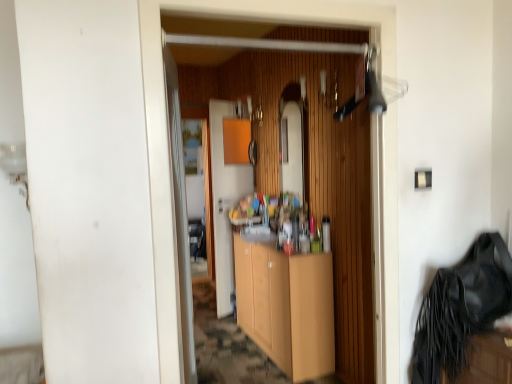
Image resolution: width=512 pixels, height=384 pixels. Describe the element at coordinates (287, 307) in the screenshot. I see `light wood cabinet at center` at that location.

Locate an element on the screen. Image resolution: width=512 pixels, height=384 pixels. light wood cabinet at center is located at coordinates (287, 307).

You are a GUI agent. You are given a task and a screenshot of the screen. Output one action in this format:
    pyautogui.click(x=<x>, y=<y>)
    Task: Click on the wooden cabinet at center
    
    Given the screenshot: What is the action you would take?
    pyautogui.click(x=225, y=201)

This screenshot has height=384, width=512. What do you see at coordinates (225, 201) in the screenshot?
I see `wooden cabinet at center` at bounding box center [225, 201].

Find the location of a particular element. This screenshot has width=512, height=384. light wood cabinet at center is located at coordinates (287, 307).

Is wooden cabinet at center to the right of light wood cabinet at center from the viewer's perspective?

In fact, wooden cabinet at center is to the left of light wood cabinet at center.

Which object is more forward, wooden cabinet at center or light wood cabinet at center?

light wood cabinet at center is in front.

Between point (213, 117) and point (314, 269), which one is positioned behind?

Positioned behind is point (213, 117).

From the image's perspective, is wooden cabinet at center above or below light wood cabinet at center?

wooden cabinet at center is above light wood cabinet at center.

From a real-world perspective, is wooden cabinet at center on light wood cabinet at center?

Indeed, from a real-world perspective, wooden cabinet at center stands above light wood cabinet at center.

Can you confirm if wooden cabinet at center is thinner than light wood cabinet at center?

Yes.

Considering the sizes of wooden cabinet at center and light wood cabinet at center in the image, is wooden cabinet at center taller or shorter than light wood cabinet at center?

Clearly, wooden cabinet at center is taller compared to light wood cabinet at center.

Between wooden cabinet at center and light wood cabinet at center, which one has larger size?

With larger size is light wood cabinet at center.

Do you think wooden cabinet at center is within light wood cabinet at center, or outside of it?

wooden cabinet at center exists outside the volume of light wood cabinet at center.

Is wooden cabinet at center in contact with light wood cabinet at center?

wooden cabinet at center and light wood cabinet at center are clearly separated.

Is wooden cabinet at center facing away from light wood cabinet at center?

No, wooden cabinet at center is not facing the opposite direction of light wood cabinet at center.

What's the angular difference between wooden cabinet at center and light wood cabinet at center's facing directions?

55.2 degrees.

Measure the distance from wooden cabinet at center to light wood cabinet at center.

wooden cabinet at center and light wood cabinet at center are 32.86 inches apart from each other.

This screenshot has width=512, height=384. I want to click on door above the light wood cabinet at center (from the image's perspective), so click(x=225, y=201).

Based on their positions, is light wood cabinet at center located to the left or right of wooden cabinet at center?

In the image, light wood cabinet at center appears on the right side of wooden cabinet at center.

Is light wood cabinet at center positioned behind wooden cabinet at center?

No, it is not.

Which is in front, point (305, 255) or point (222, 105)?

Point (305, 255)

From the image's perspective, is light wood cabinet at center under wooden cabinet at center?

Indeed, from the image's perspective, light wood cabinet at center is shown beneath wooden cabinet at center.

From a real-world perspective, relative to wooden cabinet at center, is light wood cabinet at center vertically above or below?

Clearly, from a real-world perspective, light wood cabinet at center is below wooden cabinet at center.

Considering the sizes of light wood cabinet at center and wooden cabinet at center in the image, is light wood cabinet at center wider or thinner than wooden cabinet at center?

In the image, light wood cabinet at center appears to be wider than wooden cabinet at center.

In terms of height, does light wood cabinet at center look taller or shorter compared to wooden cabinet at center?

In the image, light wood cabinet at center appears to be shorter than wooden cabinet at center.

Does light wood cabinet at center have a larger size compared to wooden cabinet at center?

Yes, light wood cabinet at center is bigger than wooden cabinet at center.

Can we say light wood cabinet at center lies outside wooden cabinet at center?

light wood cabinet at center lies outside wooden cabinet at center's area.

Is light wood cabinet at center not near wooden cabinet at center?

No, there isn't a large distance between light wood cabinet at center and wooden cabinet at center.

Is light wood cabinet at center looking in the opposite direction of wooden cabinet at center?

light wood cabinet at center is not turned away from wooden cabinet at center.

How far apart are light wood cabinet at center and wooden cabinet at center?

A distance of 32.86 inches exists between light wood cabinet at center and wooden cabinet at center.

You are a GUI agent. You are given a task and a screenshot of the screen. Output one action in this format:
    pyautogui.click(x=<x>, y=<y>)
    Task: Click on the door above the light wood cabinet at center (from a real-world perspective)
    Image resolution: width=512 pixels, height=384 pixels.
    Given the screenshot: What is the action you would take?
    pyautogui.click(x=225, y=201)

Locate an element on the screen. Image resolution: width=512 pixels, height=384 pixels. cabinetry on the right of wooden cabinet at center is located at coordinates (287, 307).

This screenshot has height=384, width=512. In order to click on door that is above the light wood cabinet at center (from a real-world perspective) in this screenshot , I will do `click(225, 201)`.